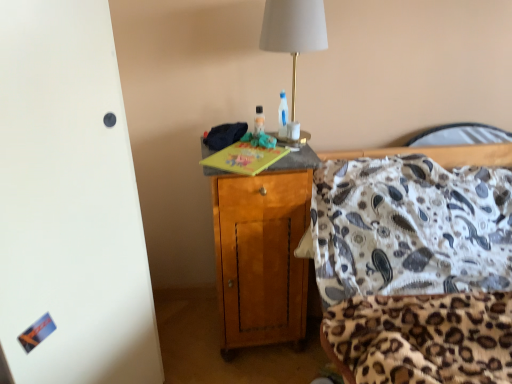
Locate an element on the screen. Image resolution: width=512 pixels, height=384 pixels. vacant region in front of translucent plastic bottle at center is located at coordinates (263, 154).